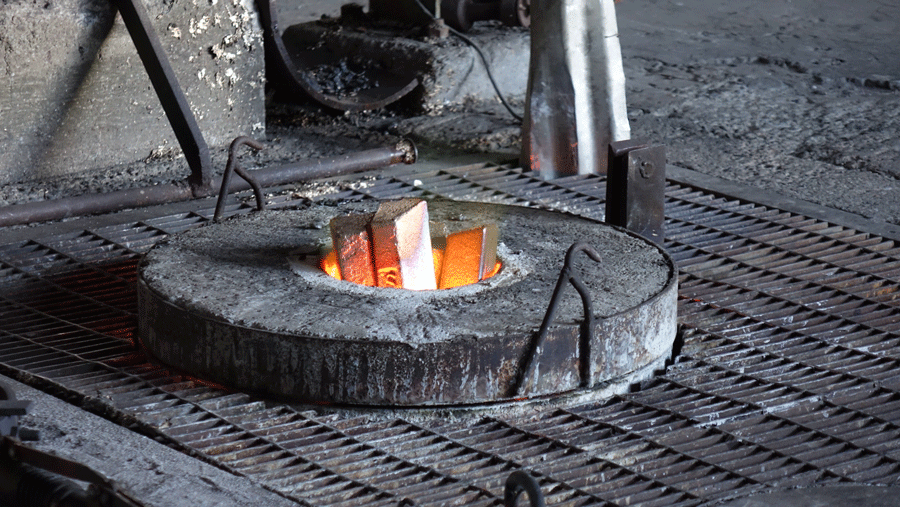
Locate an element on the screen. The height and width of the screenshot is (507, 900). grate is located at coordinates (763, 338).